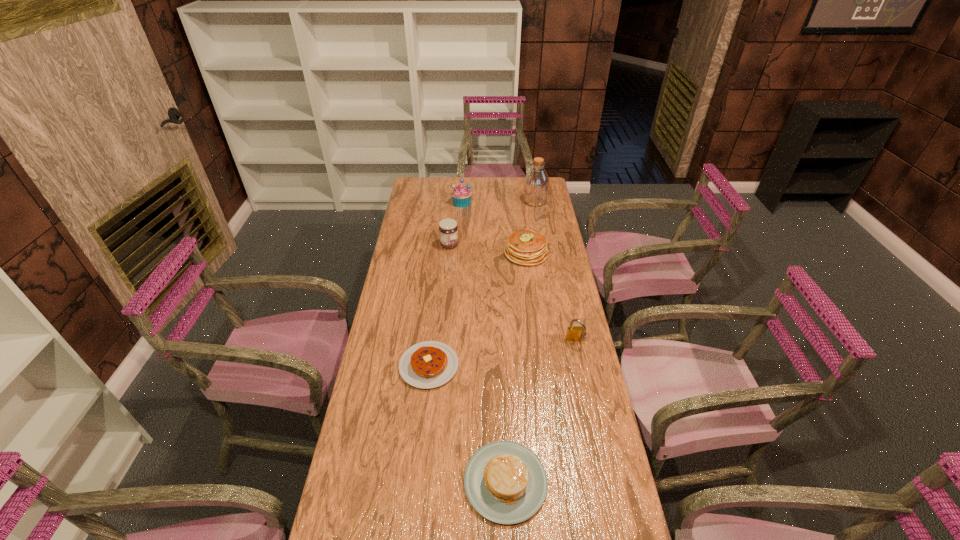
Locate an element on the screen. bottle present at the right edge is located at coordinates (536, 184).

Locate an element on the screen. padlock present at the right edge is located at coordinates (574, 334).

At what (x,y) coordinates should I click in order to perform the action: click on pancake present at the right edge. Please return your answer as a coordinate pair (x, y). The width and height of the screenshot is (960, 540). Looking at the image, I should click on (525, 247).

The height and width of the screenshot is (540, 960). I want to click on object at the far right corner, so click(536, 184).

You are a GUI agent. You are given a task and a screenshot of the screen. Output one action in this format:
    pyautogui.click(x=<x>, y=<y>)
    Task: Click on the vacant region at the left edge of the desktop
    
    Given the screenshot: What is the action you would take?
    pyautogui.click(x=394, y=320)

Identify the location of vacant region at the right edge of the desktop. Image resolution: width=960 pixels, height=540 pixels. (594, 483).

In the image, there is a desktop. Where is `free space at the far left corner`? This screenshot has height=540, width=960. free space at the far left corner is located at coordinates (414, 191).

This screenshot has width=960, height=540. I want to click on free spot between the padlock and the nearest pancake, so click(x=540, y=411).

Locate an element on the screen. This screenshot has width=960, height=540. free space between the tallest pancake and the shortest object is located at coordinates (477, 309).

This screenshot has height=540, width=960. Find the location of `free area in between the muffin and the shortest pancake`. free area in between the muffin and the shortest pancake is located at coordinates (445, 284).